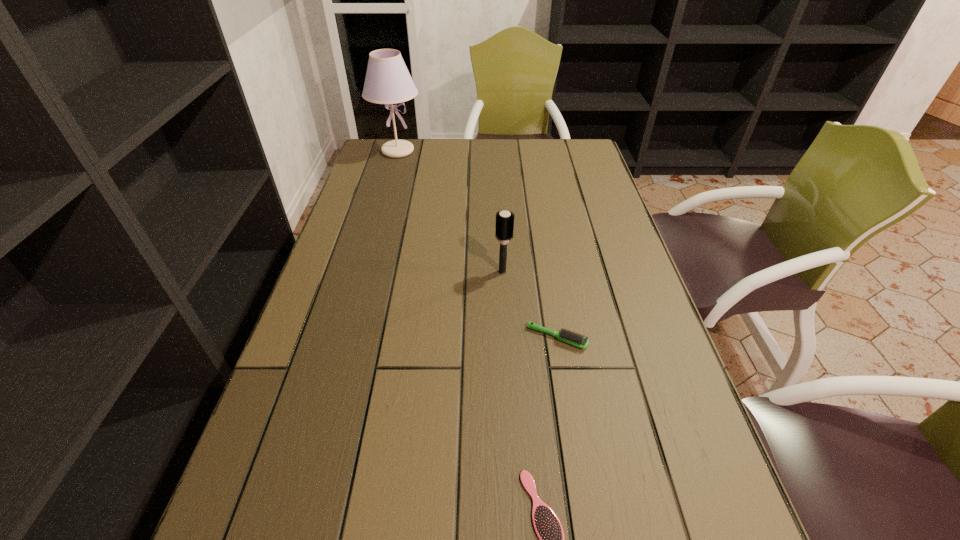
You are a GUI agent. You are given a task and a screenshot of the screen. Output one action in this format:
    pyautogui.click(x=<x>, y=<y>)
    Task: Click on the closest object to the tallest object
    The height and width of the screenshot is (540, 960).
    Given the screenshot: What is the action you would take?
    pyautogui.click(x=504, y=220)

Select which object appears as the second closest to the nearest hairbrush. Please provide its 2D coordinates. Your answer should be formatted as a tuple, i.e. [(x, y)], where the tuple contains the x and y coordinates of a point satisfying the conditions above.

[(504, 220)]

Locate an element on the screen. This screenshot has width=960, height=540. the second closest hairbrush to the shortest object is located at coordinates (504, 220).

Point out which hairbrush is positioned as the nearest to the shortest object. Please provide its 2D coordinates. Your answer should be formatted as a tuple, i.e. [(x, y)], where the tuple contains the x and y coordinates of a point satisfying the conditions above.

[(566, 336)]

I want to click on free location that satisfies the following two spatial constraints: 1. on the front side of the second nearest hairbrush; 2. on the right side of the leftmost object, so click(x=345, y=338).